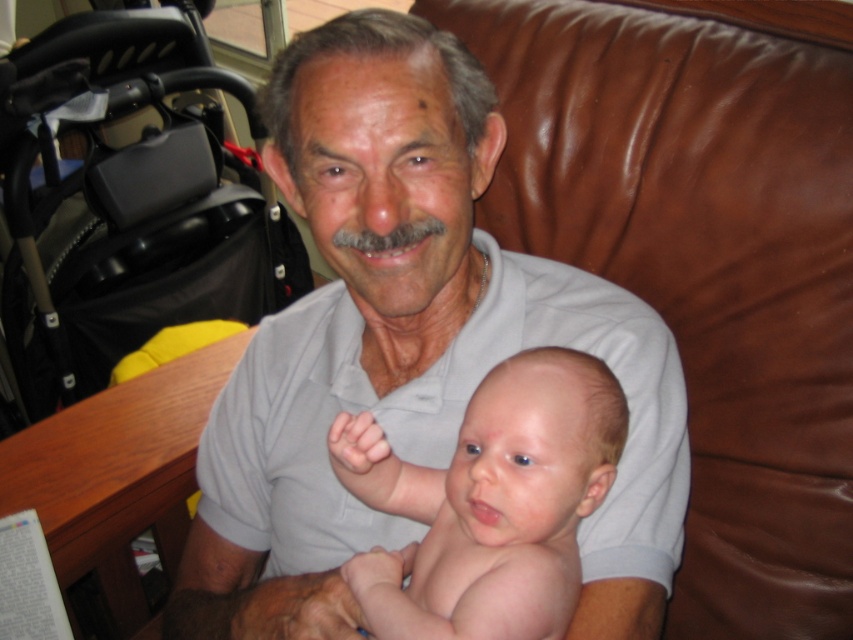
Is gray cotton shirt at center shorter than smooth skin baby at center?

In fact, gray cotton shirt at center may be taller than smooth skin baby at center.

Who is shorter, gray cotton shirt at center or smooth skin baby at center?

smooth skin baby at center

Is point (650, 486) positioned before point (492, 573)?

That is False.

At what (x,y) coordinates should I click in order to perform the action: click on gray cotton shirt at center. Please return your answer as a coordinate pair (x, y). The height and width of the screenshot is (640, 853). Looking at the image, I should click on (405, 346).

Between black plastic stroller at left and smooth skin baby at center, which one is positioned lower?

smooth skin baby at center

In the scene shown: Is black plastic stroller at left positioned before smooth skin baby at center?

No, black plastic stroller at left is behind smooth skin baby at center.

Does point (128, 342) lie in front of point (468, 632)?

That is False.

Image resolution: width=853 pixels, height=640 pixels. Identify the location of black plastic stroller at left. (138, 205).

Which of these two, gray cotton shirt at center or black plastic stroller at left, stands taller?

Standing taller between the two is black plastic stroller at left.

Which is behind, point (495, 132) or point (164, 316)?

Point (164, 316)

The height and width of the screenshot is (640, 853). In order to click on gray cotton shirt at center in this screenshot , I will do `click(405, 346)`.